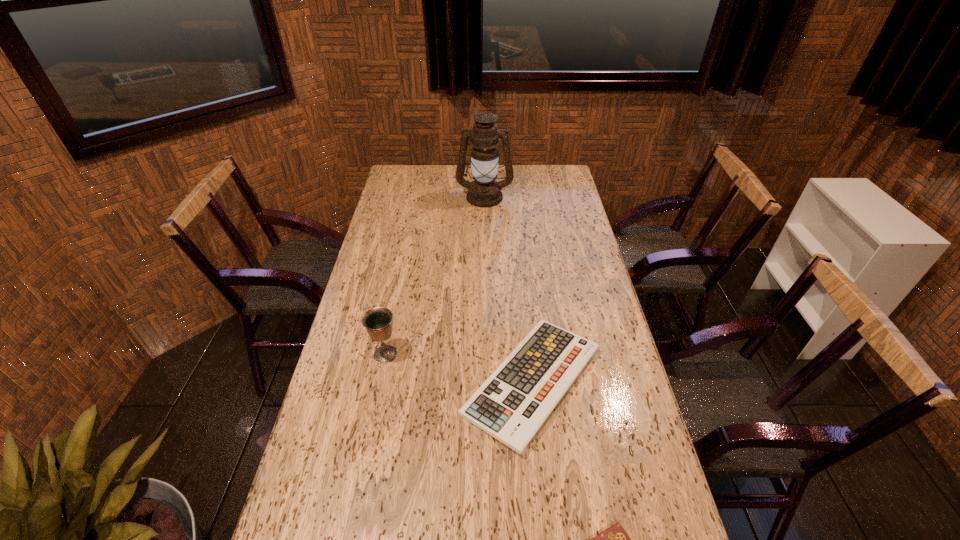
This screenshot has width=960, height=540. Find the location of `oil lamp`. oil lamp is located at coordinates (484, 191).

You are a GUI agent. You are given a task and a screenshot of the screen. Output one action in this format:
    pyautogui.click(x=<x>, y=<y>)
    Task: Click on the tallest object
    Image resolution: width=960 pixels, height=540 pixels.
    Given the screenshot: What is the action you would take?
    pyautogui.click(x=484, y=191)

Identify the location of chalice. (378, 321).

Find the location of a particular element. Image resolution: width=960 pixels, height=540 pixels. the leftmost object is located at coordinates (378, 321).

Identify the location of computer keyboard. (512, 404).

The image size is (960, 540). Find the location of `free location located on the right of the oil lamp`. free location located on the right of the oil lamp is located at coordinates (525, 197).

The image size is (960, 540). Find the location of `vacant space located 0.280m on the back of the leftmost object`. vacant space located 0.280m on the back of the leftmost object is located at coordinates (399, 283).

Identify the location of vacant area situated 0.260m on the left of the computer keyboard. (370, 381).

At what (x,y) coordinates should I click in order to perform the action: click on object situated at the far edge. Please return your answer as a coordinate pair (x, y). Looking at the image, I should click on (484, 191).

Locate an element on the screen. The image size is (960, 540). object at the left edge is located at coordinates [x=378, y=321].